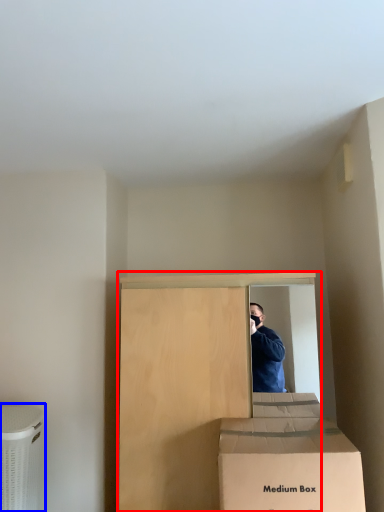
Question: Which object is further to the camera taking this photo, furniture (highlighted by a red box) or cardboard box (highlighted by a blue box)?

Choices:
 (A) furniture
 (B) cardboard box

Answer: (B)